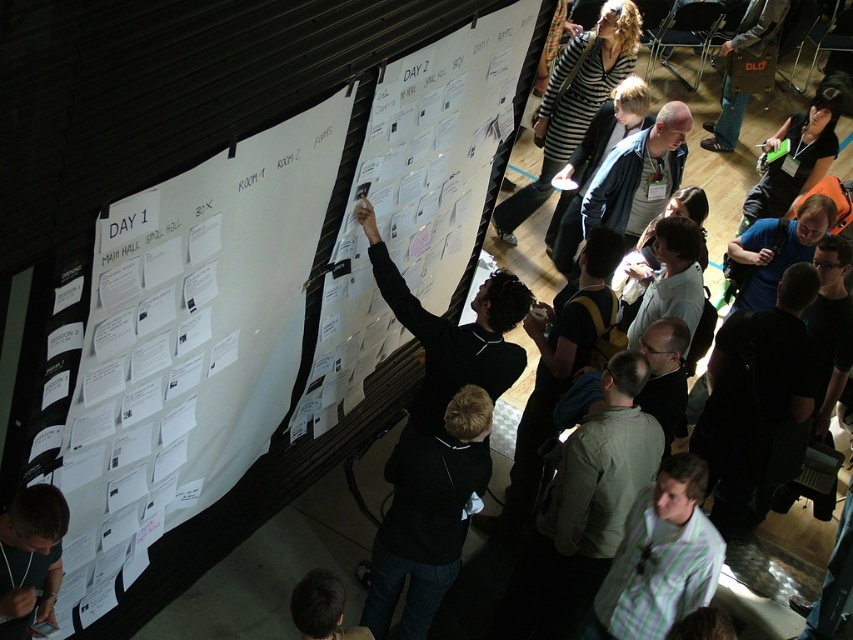
Question: Which is farther from the white paper at upper left?

Choices:
 (A) dark brown hair at lower center
 (B) leather bag at center
 (C) orange fabric shirt at upper right
 (D) green striped shirt at lower right

Answer: (B)

Question: Among these points, which one is farthest from the camera?

Choices:
 (A) (697, 545)
 (B) (448, 529)

Answer: (B)

Question: Does white paper at center have a smaller size compared to black matte jacket at center?

Choices:
 (A) yes
 (B) no

Answer: (B)

Question: Can you confirm if white paper at center is bigger than green striped shirt at lower right?

Choices:
 (A) no
 (B) yes

Answer: (B)

Question: Can you confirm if white paper at upper left is positioned above leather bag at center?

Choices:
 (A) no
 (B) yes

Answer: (A)

Question: Considering the real-world distances, which object is closest to the white paper at upper left?

Choices:
 (A) green striped shirt at lower right
 (B) orange fabric shirt at upper right
 (C) leather bag at center
 (D) black matte jacket at center

Answer: (D)